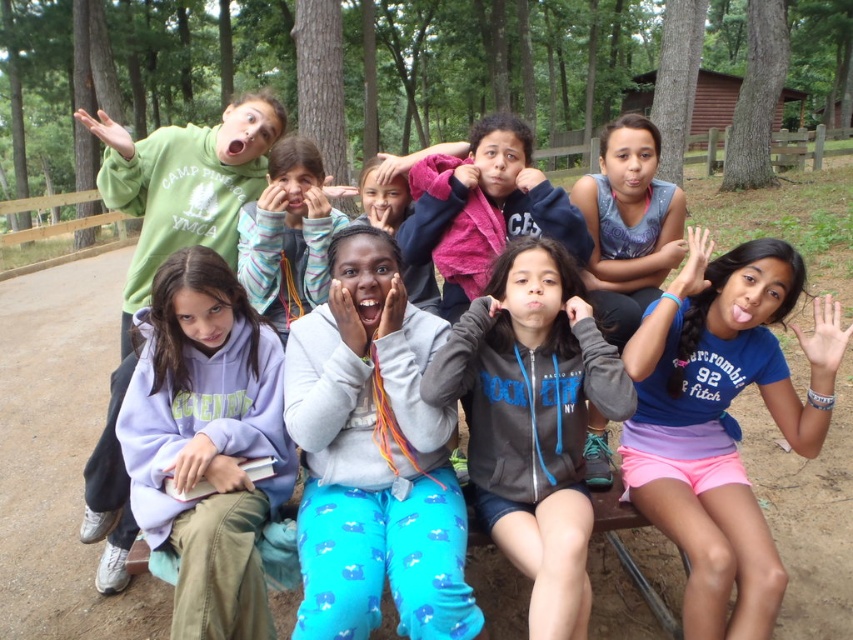
Question: Is blue cotton shirt at center closer to the viewer compared to striped fleece hoodie at center?

Choices:
 (A) yes
 (B) no

Answer: (A)

Question: Which point is farther to the camera?

Choices:
 (A) (679, 484)
 (B) (259, 227)
 (C) (236, 548)
 (D) (367, 609)

Answer: (B)

Question: Which point is farther to the camera?

Choices:
 (A) (300, 276)
 (B) (183, 269)

Answer: (A)

Question: From the image, what is the correct spatial relationship of light gray fleece sweatshirt at center in relation to striped fleece hoodie at center?

Choices:
 (A) above
 (B) below

Answer: (B)

Question: Is the position of blue cotton shirt at center more distant than that of purple fleece sweatshirt at left?

Choices:
 (A) yes
 (B) no

Answer: (A)

Question: Which point appears farthest from the camera in this image?

Choices:
 (A) (308, 230)
 (B) (219, 380)

Answer: (A)